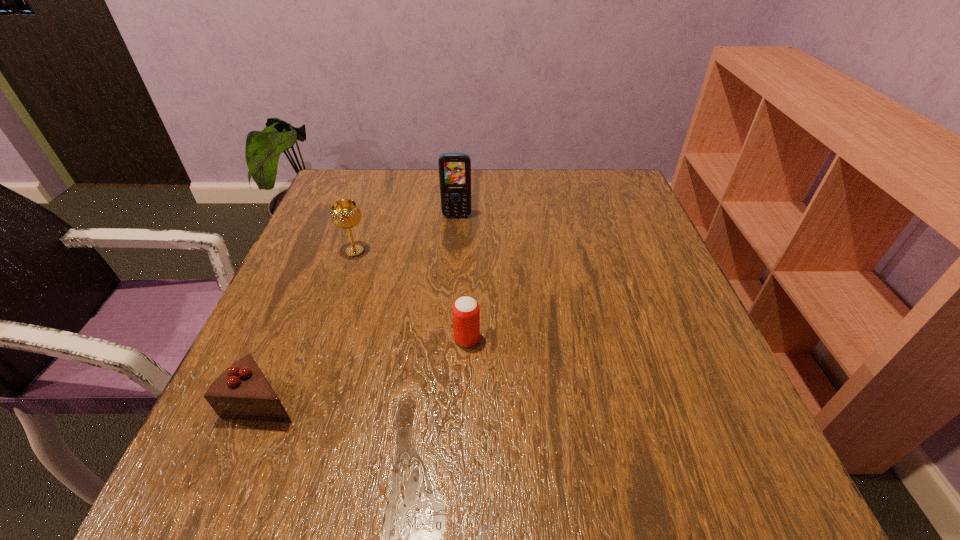
Identify the location of object that is at the far edge. Image resolution: width=960 pixels, height=540 pixels. (454, 168).

Image resolution: width=960 pixels, height=540 pixels. What are the coordinates of `chalice that is at the left edge` in the screenshot? It's located at (346, 213).

Identify the location of chocolate cake positioned at the left edge. The width and height of the screenshot is (960, 540). (242, 392).

I want to click on vacant position at the far edge of the desktop, so click(539, 185).

This screenshot has height=540, width=960. What are the coordinates of `free space at the left edge of the desktop` in the screenshot? It's located at (317, 335).

Locate an element on the screen. This screenshot has width=960, height=540. vacant space at the right edge of the desktop is located at coordinates (631, 344).

Locate an element on the screen. The width and height of the screenshot is (960, 540). free space at the far left corner is located at coordinates (325, 216).

Where is `vacant space at the far right corner of the desktop`? The width and height of the screenshot is (960, 540). vacant space at the far right corner of the desktop is located at coordinates click(645, 212).

Locate an element on the screen. The width and height of the screenshot is (960, 540). free spot between the cellular telephone and the third farthest object is located at coordinates (462, 278).

The image size is (960, 540). What are the coordinates of `empty space between the chalice and the beer can` in the screenshot? It's located at (411, 295).